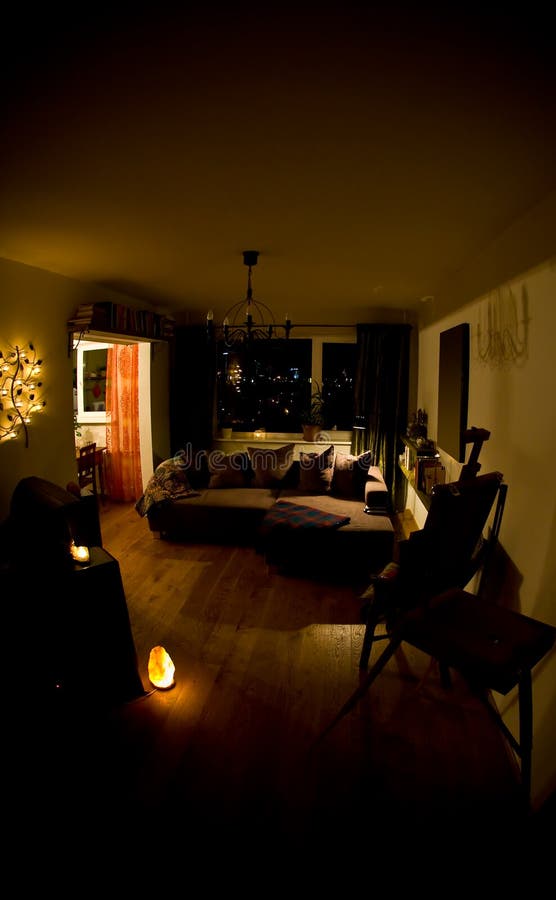
The width and height of the screenshot is (556, 900). I want to click on chandelier, so click(x=248, y=328).